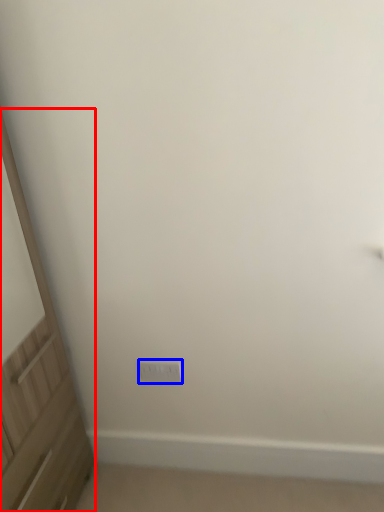
Question: Which of the following is the farthest to the observer, screen door (highlighted by a red box) or electric outlet (highlighted by a blue box)?

Choices:
 (A) screen door
 (B) electric outlet

Answer: (B)